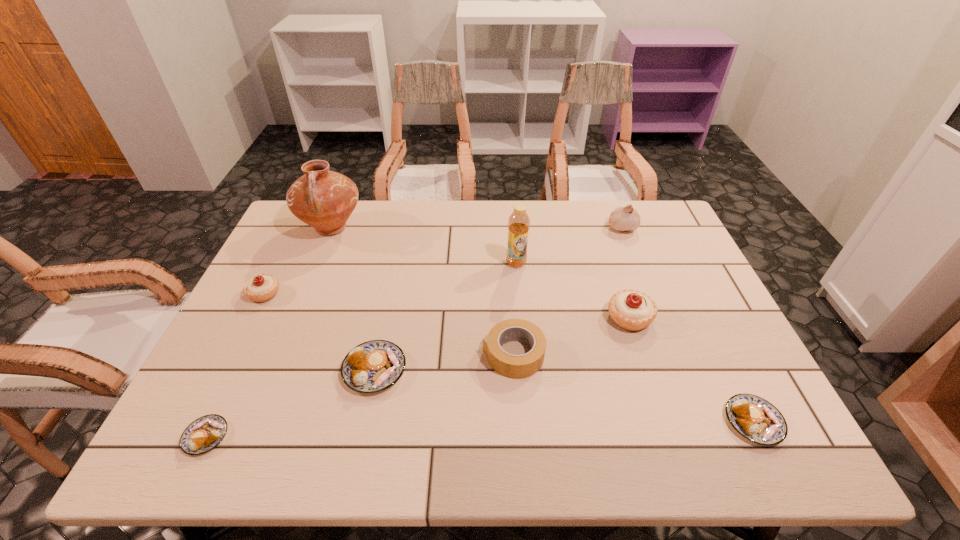
You are a GUI agent. You are given a task and a screenshot of the screen. Output one action in this format:
    pyautogui.click(x=<x>, y=<y>)
    Task: Click on the blank space at the near right corner of the desktop
    The image size is (960, 540).
    Given the screenshot: What is the action you would take?
    pyautogui.click(x=747, y=452)

Locate an element on the screen. Image resolution: width=960 pixels, height=540 pixels. unoccupied area between the shortest pastry and the garlic is located at coordinates (414, 332).

Locate an element on the screen. This screenshot has height=540, width=960. vacant space that is in between the rightmost brown pastry and the seventh nearest object is located at coordinates (635, 342).

You are a GUI agent. You are given a task and a screenshot of the screen. Output one action in this format:
    pyautogui.click(x=<x>, y=<y>)
    Task: Click on the vacant area that lies between the shortest object and the right beige pastry
    
    Given the screenshot: What is the action you would take?
    point(418,377)

Where is `free space between the smallest brown pastry and the fifth tallest object`? The width and height of the screenshot is (960, 540). free space between the smallest brown pastry and the fifth tallest object is located at coordinates click(x=235, y=365).

This screenshot has height=540, width=960. In order to click on empty location between the shortest pastry and the biggest brown pastry in this screenshot , I will do `click(290, 403)`.

Find the location of a particular element. The width and height of the screenshot is (960, 540). free space between the tallest pastry and the leftmost brown pastry is located at coordinates (418, 377).

At what (x,y) coordinates should I click in order to perform the action: click on empty space that is in between the third pastry from right to left and the garlic. Please return your answer as a coordinate pair (x, y). This screenshot has width=960, height=540. Looking at the image, I should click on (498, 299).

The image size is (960, 540). I want to click on vacant space that's between the third pastry from right to left and the garlic, so click(x=498, y=299).

Locate an element on the screen. Image resolution: width=960 pixels, height=540 pixels. vacant area that lies between the pottery and the right beige pastry is located at coordinates (481, 273).